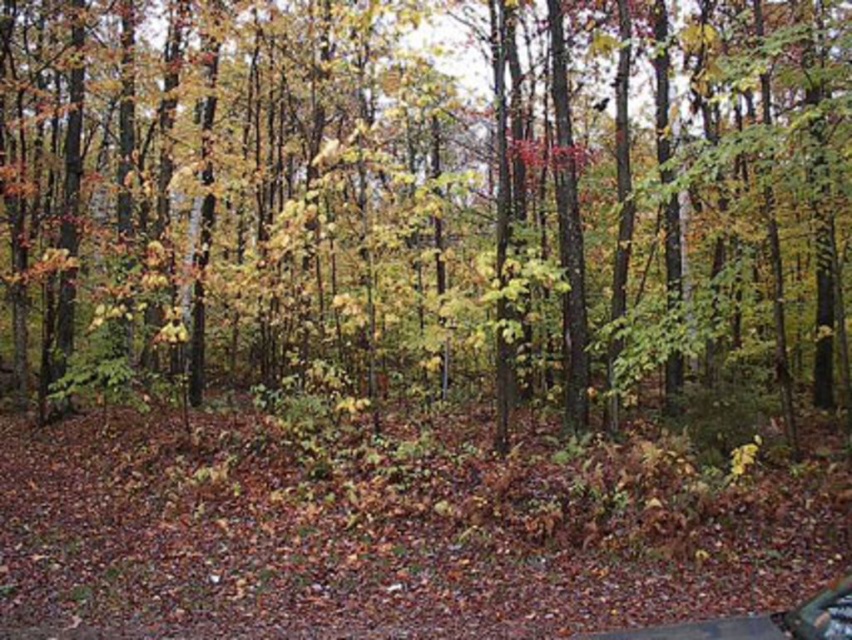
You are a hiker who wants to reach the metallic silver car at lower right but must navigate around the green matte tree at center. Which direction should you move relative to the tree to avoid it?

The green matte tree at center is closer to you than the metallic silver car at lower right. To reach the car, you should move around the tree either to the left or right side of it so you can proceed towards the car located behind the tree.

You are standing in the forest and see two points marked in the image. Which point is closer to you, point (850, 134) or point (822, 627)?

Point (822, 627) is closer to you because the description states that point (850, 134) is further to the camera than point (822, 627).